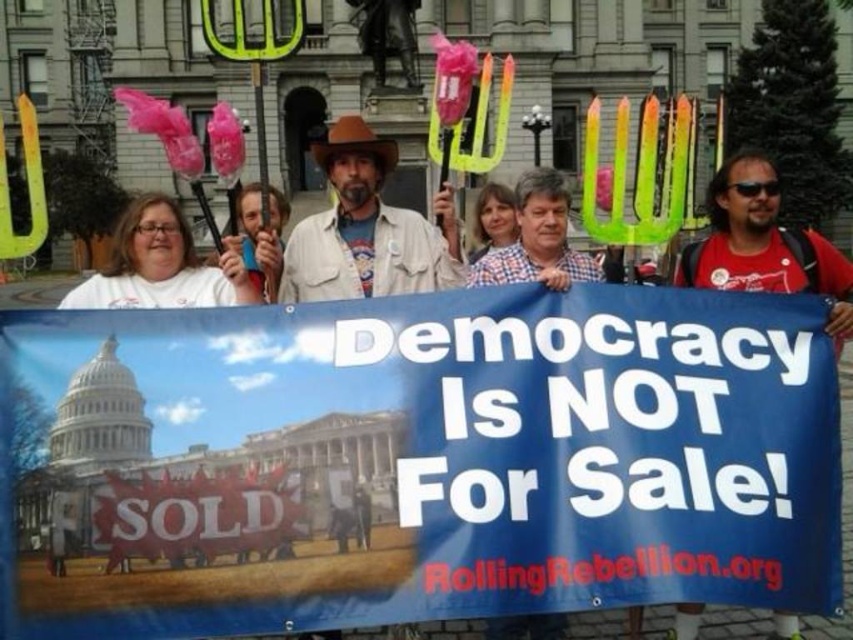
Question: Which point is farther to the camera?

Choices:
 (A) red matte shirt at center
 (B) brown leather jacket at center

Answer: (B)

Question: Which point is closer to the camera?

Choices:
 (A) (509, 634)
 (B) (717, 257)

Answer: (A)

Question: Can you confirm if red matte shirt at center is smaller than checkered shirt at center?

Choices:
 (A) no
 (B) yes

Answer: (A)

Question: Does brown leather jacket at center have a larger size compared to red matte shirt at center?

Choices:
 (A) no
 (B) yes

Answer: (A)

Question: Which point appears farthest from the camera in this image?

Choices:
 (A) (241, 284)
 (B) (711, 188)

Answer: (B)

Question: Considering the relative positions of brown leather jacket at center and white t-shirt at center in the image provided, where is brown leather jacket at center located with respect to white t-shirt at center?

Choices:
 (A) below
 (B) above

Answer: (B)